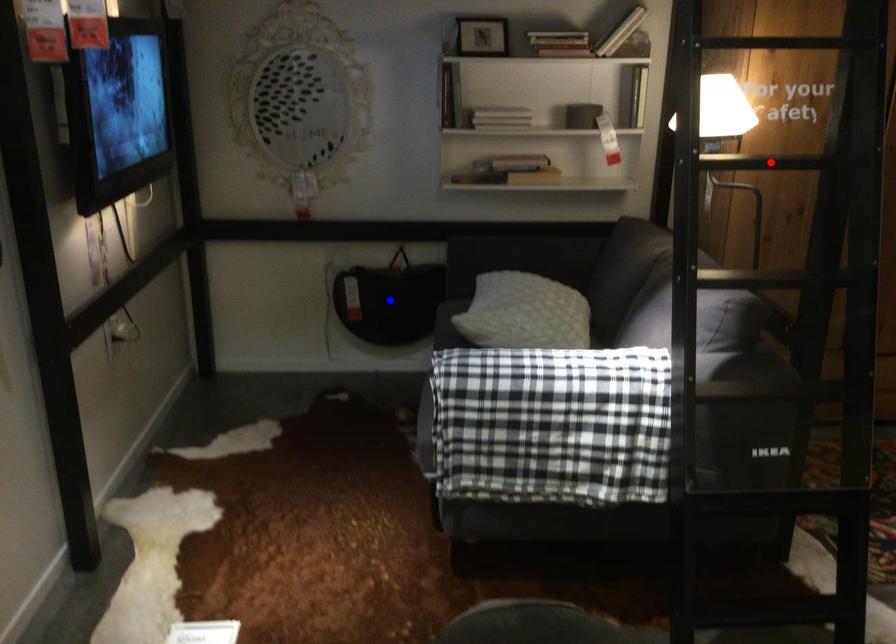
Question: In the image, two points are highlighted. Which point is nearer to the camera? Reply with the corresponding letter.

Choices:
 (A) blue point
 (B) red point

Answer: (B)